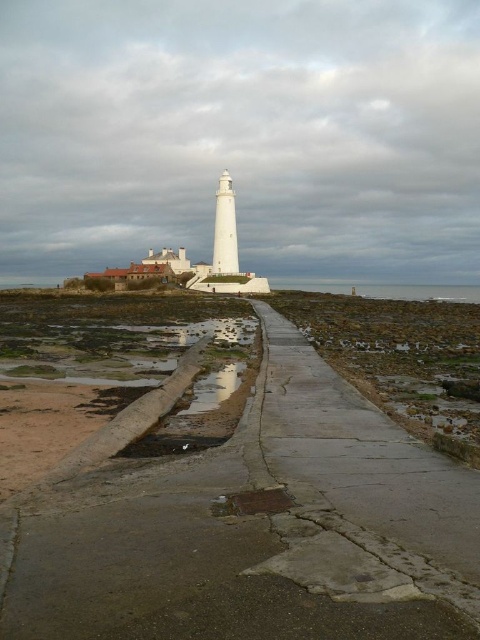
From the picture: You are standing on the beach and want to reach the lighthouse. There is a point at coordinates point [362,472] that is 34.26 meters away from you. Is this point closer to you than the lighthouse?

The point at point [362,472] is 34.26 meters away from the viewer, but the distance to the lighthouse isn not provided. Therefore, it is impossible to determine if the point is closer than the lighthouse without additional information.

You are a delivery person carrying a heavy box and need to walk from the parking lot to the lighthouse. You see the concrete sidewalk at center and the glossy concrete puddle at lower center. Which path should you choose to avoid slipping?

You should choose the concrete sidewalk at center because it is positioned on the right side of the glossy concrete puddle at lower center, which is likely slippery due to being a puddle.

You are a delivery robot with a maximum travel distance of 15 meters. You need to deliver a package from the concrete at center to the glossy concrete puddle at lower center. Can you complete the delivery without exceeding your travel limit?

The distance between the concrete at center and the glossy concrete puddle at lower center is 16.17 meters, which exceeds the robot maximum travel distance of 15 meters. Therefore, the delivery cannot be completed without exceeding the travel limit.